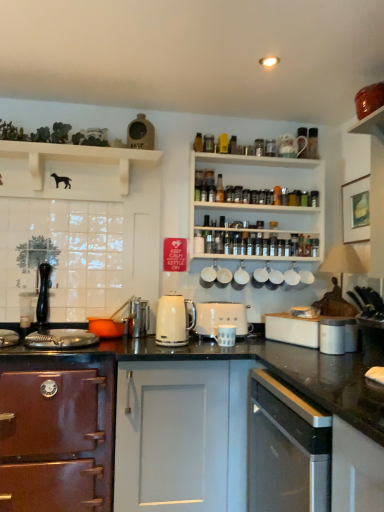
Identify the location of vacant space underneath cream matte electric kettle at center (from a real-world perspective). (185, 345).